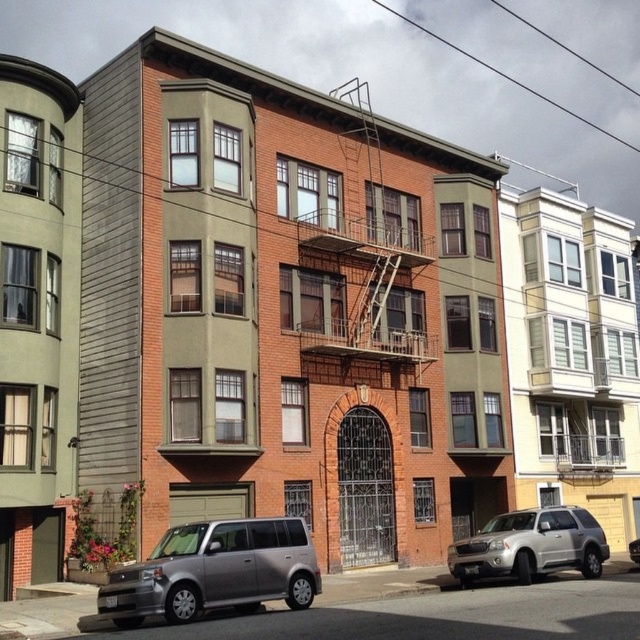
You are a delivery driver who needs to park your satin silver minivan at lower left near the brick fire escape at center. Considering their sizes, will your minivan fit in the space allocated for parking next to the fire escape?

The satin silver minivan at lower left is smaller than the brick fire escape at center. Since the minivan is smaller, it should fit in the space allocated for parking next to the fire escape.

You are standing in front of the central residential building and want to take a photo. There are two points of interest marked as point 1 and point 2. Point 1 is at coordinates point (x=384, y=184) and point 2 is at point (x=481, y=536). Which point should you focus on first if you want to capture the closest object in your shot?

Point 1 at coordinates point (x=384, y=184) is closer to the camera than point 2 at point (x=481, y=536), so you should focus on point 1 first to capture the closest object in your shot.

You are a delivery driver who needs to park your satin silver minivan at lower left in a designated parking spot located at coordinates point 0.894, 0.336. Is your vehicle already positioned correctly?

The satin silver minivan at lower left is already positioned at point [214,572], so it is correctly parked in the designated parking spot.